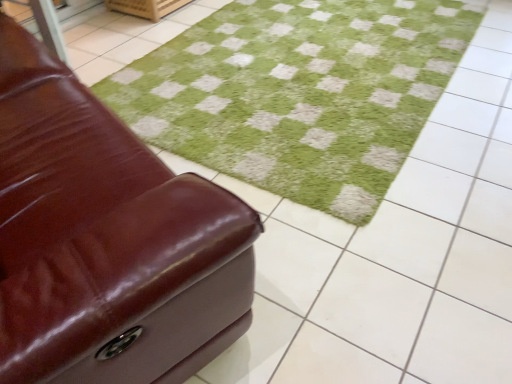
Question: Looking at the image, does green soft rug at center seem bigger or smaller compared to shiny brown leather ottoman at left?

Choices:
 (A) big
 (B) small

Answer: (B)

Question: Looking at their shapes, would you say green soft rug at center is wider or thinner than shiny brown leather ottoman at left?

Choices:
 (A) wide
 (B) thin

Answer: (A)

Question: Is green soft rug at center inside or outside of shiny brown leather ottoman at left?

Choices:
 (A) inside
 (B) outside

Answer: (B)

Question: Looking at their shapes, would you say shiny brown leather ottoman at left is wider or thinner than green soft rug at center?

Choices:
 (A) thin
 (B) wide

Answer: (A)

Question: From the image's perspective, relative to green soft rug at center, is shiny brown leather ottoman at left above or below?

Choices:
 (A) below
 (B) above

Answer: (A)

Question: Would you say shiny brown leather ottoman at left is to the left or to the right of green soft rug at center in the picture?

Choices:
 (A) left
 (B) right

Answer: (A)

Question: Is shiny brown leather ottoman at left in front of or behind green soft rug at center in the image?

Choices:
 (A) behind
 (B) front

Answer: (B)